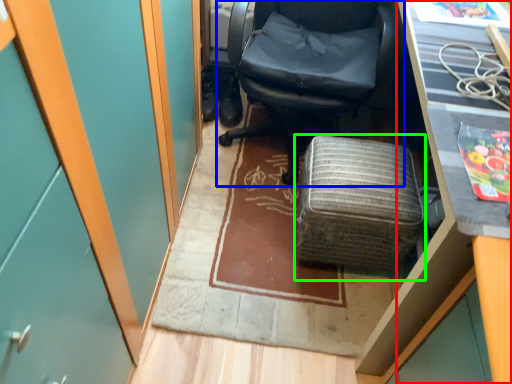
Question: Considering the real-world distances, which object is farthest from desk (highlighted by a red box)? chair (highlighted by a blue box) or furniture (highlighted by a green box)?

Choices:
 (A) chair
 (B) furniture

Answer: (A)